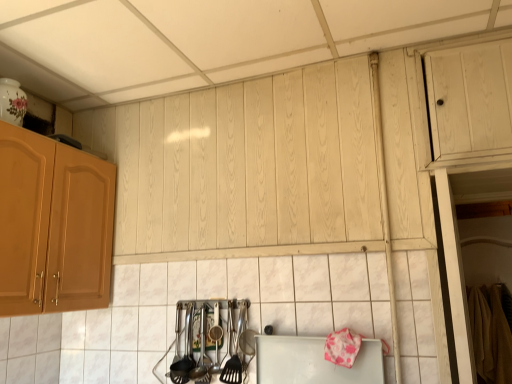
Locate an element on the screen. free space above white glossy tile at center (from a real-world perspective) is located at coordinates (240, 258).